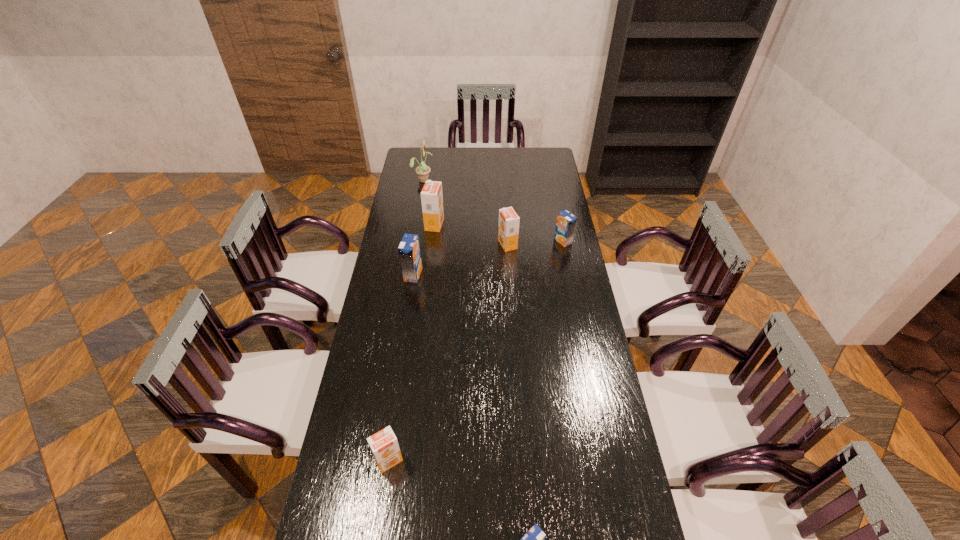
Locate an element on the screen. The image size is (960, 540). the farthest object is located at coordinates (422, 170).

Locate an element on the screen. yellow sunflower is located at coordinates (422, 170).

Locate an element on the screen. This screenshot has width=960, height=540. the biggest orange orange juice is located at coordinates (431, 195).

You are a GUI agent. You are given a task and a screenshot of the screen. Output one action in this format:
    pyautogui.click(x=<x>, y=<y>)
    Task: Click on the farthest orange orange juice
    
    Given the screenshot: What is the action you would take?
    pyautogui.click(x=431, y=195)

Find the location of a particular element. the second nearest blue orange_juice is located at coordinates (409, 249).

Identify the location of the biggest blue orange_juice. The height and width of the screenshot is (540, 960). (409, 249).

This screenshot has width=960, height=540. What are the coordinates of `the second biggest orange orange juice` in the screenshot? It's located at (508, 227).

Where is `the second nearest orange orange juice`? the second nearest orange orange juice is located at coordinates pyautogui.click(x=508, y=227).

The image size is (960, 540). Identify the location of the second biggest blue orange_juice. (566, 222).

I want to click on the rightmost blue orange_juice, so click(x=566, y=222).